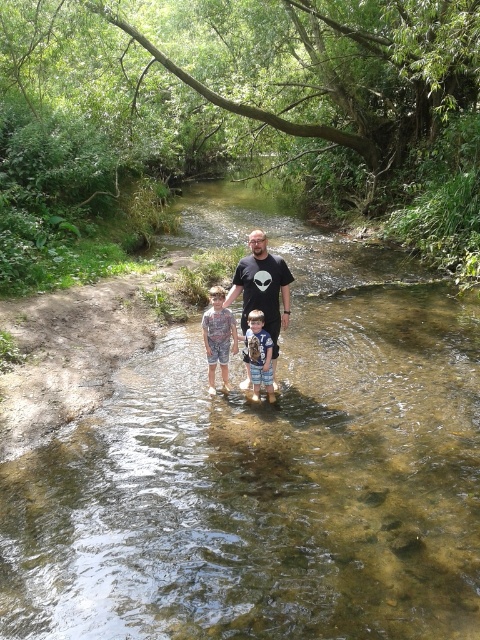
Question: Which object is farther from the camera taking this photo?

Choices:
 (A) light blue denim shorts at center
 (B) black matte t-shirt at center
 (C) camouflage shorts at center

Answer: (C)

Question: Is black matte t-shirt at center thinner than camouflage shorts at center?

Choices:
 (A) yes
 (B) no

Answer: (B)

Question: Is black matte t-shirt at center to the right of light blue denim shorts at center from the viewer's perspective?

Choices:
 (A) yes
 (B) no

Answer: (A)

Question: Considering the real-world distances, which object is closest to the camouflage shorts at center?

Choices:
 (A) light blue denim shorts at center
 (B) black matte t-shirt at center

Answer: (B)

Question: Which of these objects is positioned farthest from the light blue denim shorts at center?

Choices:
 (A) camouflage shorts at center
 (B) black matte t-shirt at center

Answer: (A)

Question: Does camouflage shorts at center appear over light blue denim shorts at center?

Choices:
 (A) no
 (B) yes

Answer: (B)